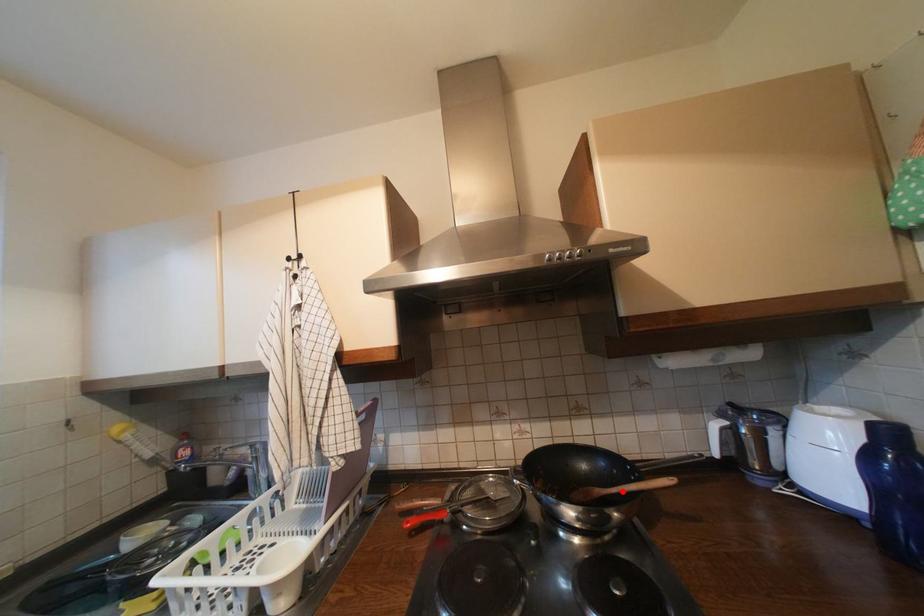
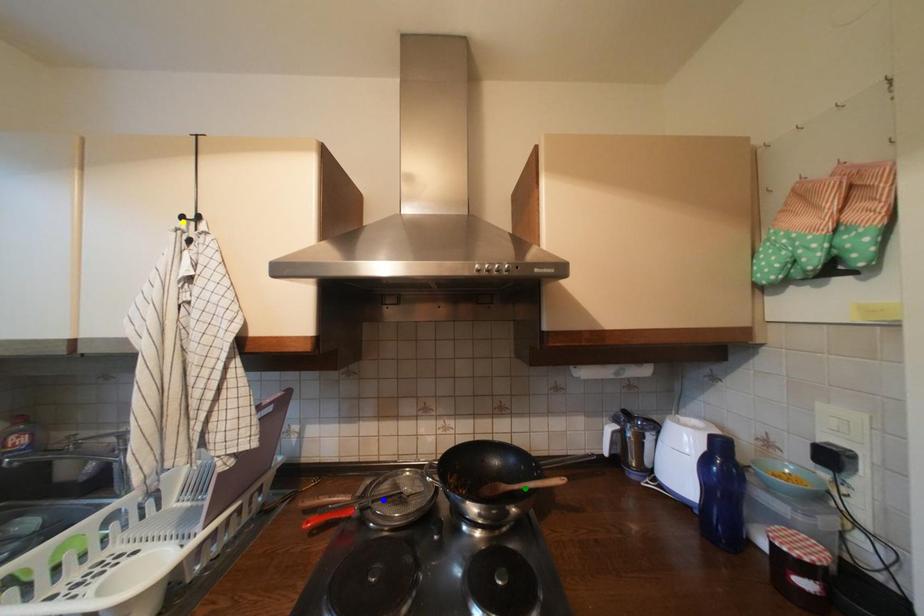
Question: I am providing you with two images of the same scene from different viewpoints. A red point is marked on the first image. You are given multiple points on the second image. Which point in image 2 is actually the same real-world point as the red point in image 1?

Choices:
 (A) green point
 (B) yellow point
 (C) blue point

Answer: (A)